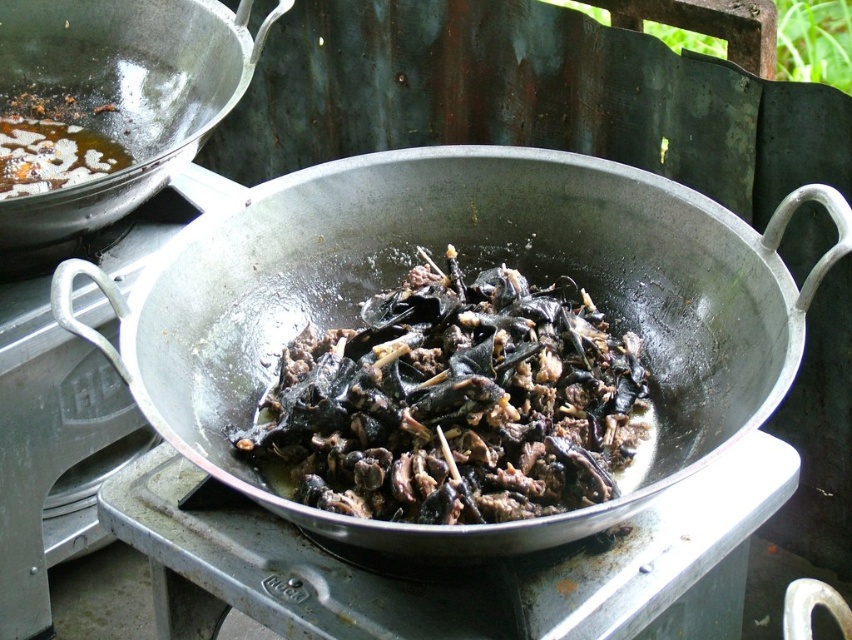
You are a chef trying to reach the shiny metallic wok at upper left to stir the ingredients. However, your arm is only 1 meter long. Can you reach it without moving the black matte wok at center?

The black matte wok at center is positioned under the shiny metallic wok at upper left, so the shiny metallic wok at upper left is above the black matte wok at center. Since the black matte wok at center is in the way, you cannot reach the shiny metallic wok at upper left without moving it first.

Please look at the image and tell me what is located at the point with coordinates point (x=455, y=403)?

The black matte food at center is located at point (x=455, y=403).

You are a chef trying to choose between two woks for a stir fry recipe that requires a wider cooking surface. Based on the image, which wok between the black matte wok at center and the shiny metallic wok at upper left should you select?

The black matte wok at center has a greater width than the shiny metallic wok at upper left, so you should choose the black matte wok at center for the stir fry recipe requiring a wider cooking surface.